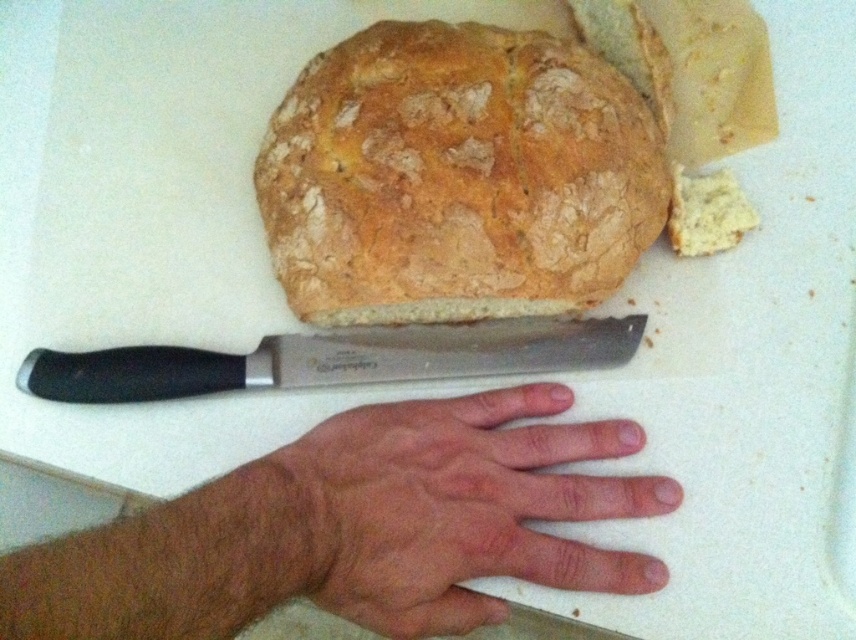
Question: Observing the image, what is the correct spatial positioning of dry skin at center in reference to black plastic handle knife at center?

Choices:
 (A) right
 (B) left

Answer: (A)

Question: Which of the following is the farthest from the observer?

Choices:
 (A) (21, 388)
 (B) (415, 522)

Answer: (A)

Question: Is the position of golden brown crusty bread at upper center less distant than that of black plastic handle knife at center?

Choices:
 (A) yes
 (B) no

Answer: (B)

Question: Which of the following is the closest to the observer?

Choices:
 (A) golden brown crusty bread at upper center
 (B) dry skin at center

Answer: (B)

Question: Which of the following is the farthest from the observer?

Choices:
 (A) (531, 328)
 (B) (428, 60)
 (C) (468, 532)

Answer: (A)

Question: Does dry skin at center come in front of black plastic handle knife at center?

Choices:
 (A) yes
 (B) no

Answer: (A)